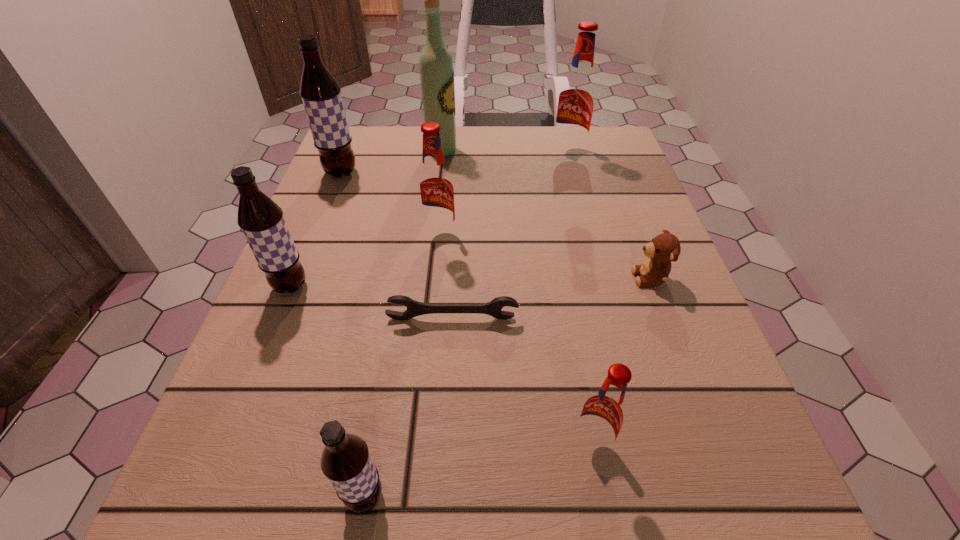
Find the location of a particular element. white wine bottle is located at coordinates (436, 66).

The width and height of the screenshot is (960, 540). Find the location of `the biggest red root beer`. the biggest red root beer is located at coordinates (577, 96).

I want to click on the farthest red root beer, so click(x=577, y=96).

Locate an element on the screen. The height and width of the screenshot is (540, 960). the biggest brown root beer is located at coordinates (321, 95).

Where is `the farthest brown root beer`? This screenshot has height=540, width=960. the farthest brown root beer is located at coordinates (321, 95).

Locate an element on the screen. the second farthest red root beer is located at coordinates (435, 186).

Locate an element on the screen. Image resolution: width=960 pixels, height=540 pixels. the second smallest red root beer is located at coordinates (435, 186).

Find the location of a particular element. This screenshot has width=960, height=540. the second nearest brown root beer is located at coordinates (260, 218).

Find the location of `the second smallest brown root beer`. the second smallest brown root beer is located at coordinates (260, 218).

Find the location of a particular element. The height and width of the screenshot is (540, 960). the second root beer from right to left is located at coordinates (603, 415).